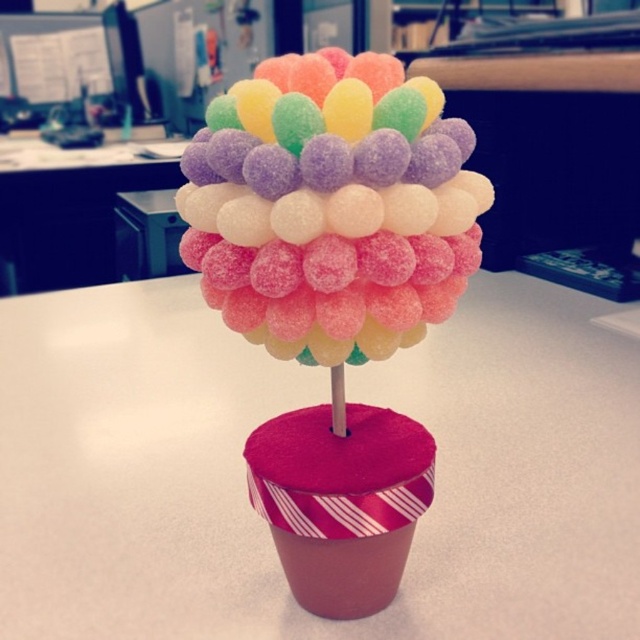
Between white matte table at center and glossy plastic candy at center, which one has more height?

white matte table at center

Who is positioned more to the left, white matte table at center or glossy plastic candy at center?

Positioned to the left is glossy plastic candy at center.

Does point (17, 337) come farther from viewer compared to point (410, 157)?

Yes, it is.

You are a GUI agent. You are given a task and a screenshot of the screen. Output one action in this format:
    pyautogui.click(x=<x>, y=<y>)
    Task: Click on the white matte table at center
    The height and width of the screenshot is (640, 640).
    Given the screenshot: What is the action you would take?
    pyautogui.click(x=292, y=408)

Is point (205, 198) positioned behind point (170, 173)?

No.

How much distance is there between glossy plastic candy at center and white glossy table at upper center?

3.48 feet

Does point (400, 218) come in front of point (131, 156)?

Yes, point (400, 218) is in front of point (131, 156).

At what (x,y) coordinates should I click in order to perform the action: click on glossy plastic candy at center. Please return your answer as a coordinate pair (x, y). Looking at the image, I should click on (330, 205).

Which of these two, white matte table at center or white glossy table at upper center, stands shorter?

Standing shorter between the two is white glossy table at upper center.

Does white matte table at center have a greater width compared to white glossy table at upper center?

Yes, white matte table at center is wider than white glossy table at upper center.

Between point (218, 419) and point (166, 161), which one is positioned in front?

Point (218, 419)

Locate an element on the screen. white matte table at center is located at coordinates (292, 408).